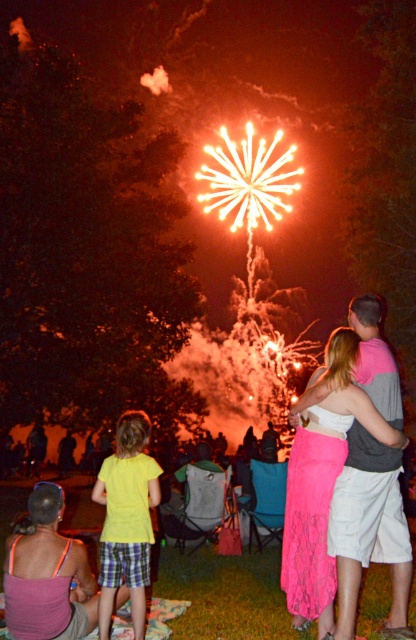
You are standing in the crowd watching the fireworks. You see two points in the sky, one at point coordinates point [121,552] and another at point [356,348]. Which point is closer to you?

Point [121,552] is further to the viewer than point [356,348], so the point at [356,348] is closer to you.

You are a photographer taking pictures of the fireworks. You notice the yellow cotton shirt at lower left and the pink lace skirt at center in your frame. Which object should you zoom in on to capture more details of the smaller one?

The pink lace skirt at center is smaller than the yellow cotton shirt at lower left, so you should zoom in on the pink lace skirt at center to capture more details of the smaller one.